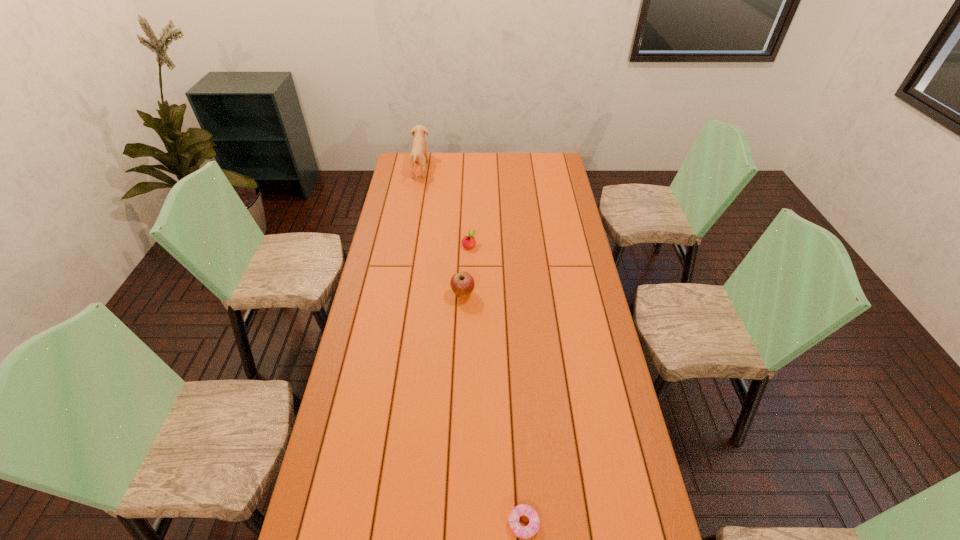
This screenshot has width=960, height=540. What are the coordinates of `puppy` in the screenshot? It's located at [419, 153].

Find the location of a particular element. the leftmost object is located at coordinates (419, 153).

Locate an element on the screen. The image size is (960, 540). the second nearest object is located at coordinates (462, 283).

Locate an element on the screen. This screenshot has width=960, height=540. the taller apple is located at coordinates (462, 283).

The width and height of the screenshot is (960, 540). In order to click on the shorter apple in this screenshot , I will do `click(468, 242)`.

This screenshot has width=960, height=540. What are the coordinates of `the third tallest object` in the screenshot? It's located at (468, 242).

Locate an element on the screen. This screenshot has height=540, width=960. free space located on the left side of the farthest object is located at coordinates (475, 168).

At what (x,y) coordinates should I click in order to perform the action: click on free location located 0.300m on the right of the third shortest object. Please return your answer as a coordinate pair (x, y). Looking at the image, I should click on (550, 294).

Where is `vacant space located 0.300m on the back of the third nearest object`? vacant space located 0.300m on the back of the third nearest object is located at coordinates (470, 200).

This screenshot has height=540, width=960. I want to click on object at the far edge, so click(x=419, y=153).